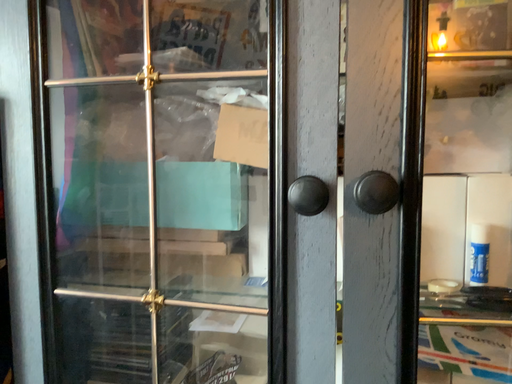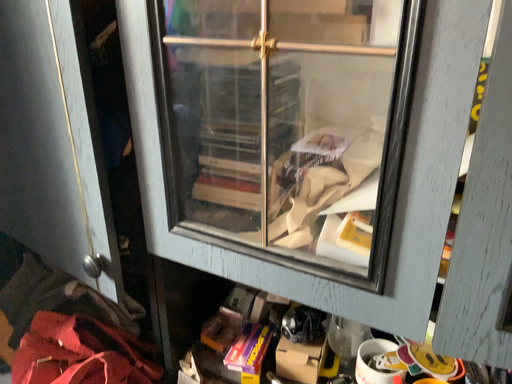
Question: Which way did the camera rotate in the video?

Choices:
 (A) rotated upward
 (B) rotated downward

Answer: (B)